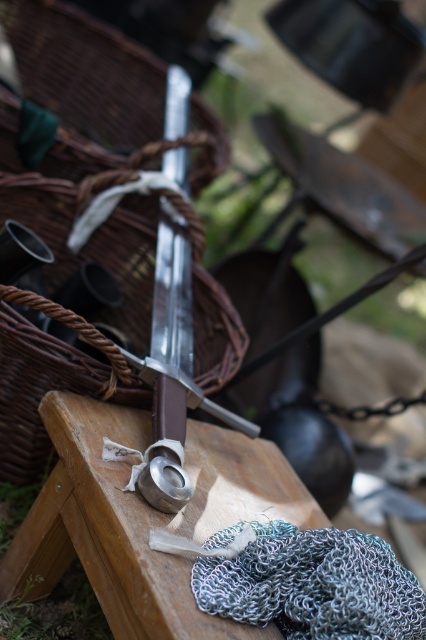
Describe the element at coordinates (86, 145) in the screenshot. This screenshot has width=426, height=640. I see `brown woven basket at center` at that location.

Who is higher up, brown woven basket at center or polished silver sword at center?

Positioned higher is brown woven basket at center.

Is point (95, 120) closer to camera compared to point (169, 396)?

No, (95, 120) is behind (169, 396).

At what (x,y) coordinates should I click in order to perform the action: click on brown woven basket at center. Please return your answer as a coordinate pair (x, y). This screenshot has height=640, width=426. Looking at the image, I should click on click(x=86, y=145).

You are a GUI agent. You are given a task and a screenshot of the screen. Output one action in this format:
    pyautogui.click(x=<x>, y=<y>)
    Task: Click on the wooden table at center
    Image resolution: width=426 pixels, height=640 pixels.
    Given the screenshot: What is the action you would take?
    pyautogui.click(x=144, y=518)

What do you see at coordinates (144, 518) in the screenshot? The image size is (426, 640). I see `wooden table at center` at bounding box center [144, 518].

Image resolution: width=426 pixels, height=640 pixels. I want to click on wooden table at center, so click(144, 518).

Which is more to the right, brown woven basket at center or chainmail at center?

chainmail at center

Between brown woven basket at center and chainmail at center, which one has less height?

Standing shorter between the two is chainmail at center.

Is point (143, 264) farther from camera compared to point (256, 534)?

That is True.

Where is `brown woven basket at center`? The width and height of the screenshot is (426, 640). brown woven basket at center is located at coordinates (86, 145).